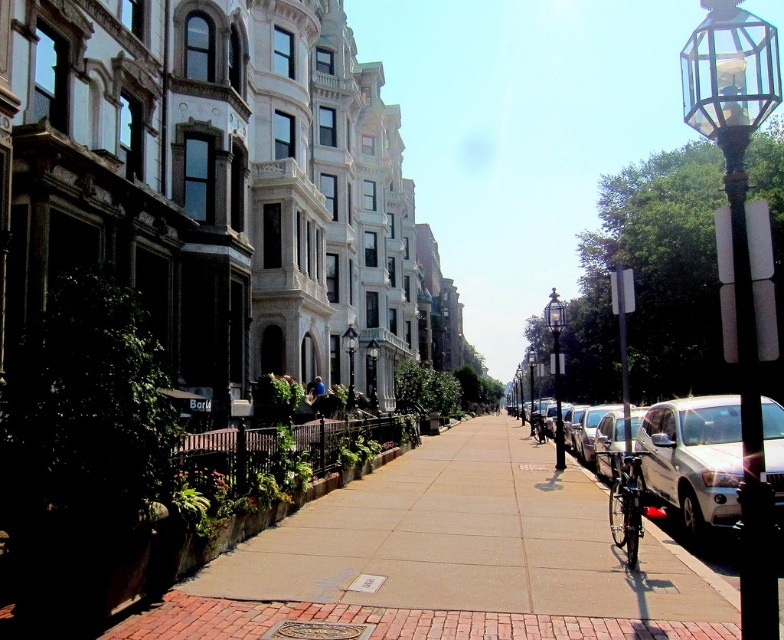
You are standing on the sidewalk in the image and want to walk from point A to point B. Point A is at coordinates point (608, 424) and point B is at coordinates point (543, 424). According to the scene description, which direction should you face to walk towards point B from point A?

You should face downward to walk towards point B from point A since point (608, 424) is in front of point (543, 424).

You are a delivery person trying to park your delivery van between the polished brass lamp post at center and the shiny black bicycle at center. The van is 2 meters wide. Can the van fit in the space between them?

The polished brass lamp post at center is narrower than the shiny black bicycle at center. However, the exact width of the space between them isn not specified in the Objects Description. Therefore, it is uncertain whether the van can fit.